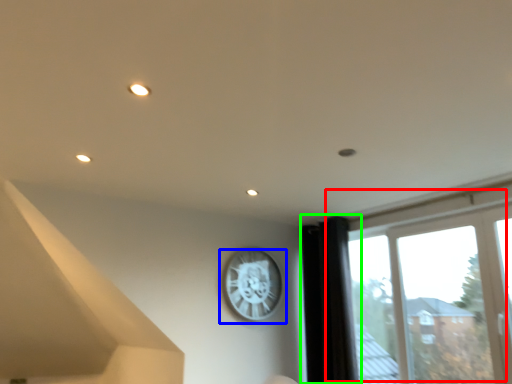
Question: Estimate the real-world distances between objects in this image. Which object is closer to window (highlighted by a red box), wall clock (highlighted by a blue box) or curtain (highlighted by a green box)?

Choices:
 (A) wall clock
 (B) curtain

Answer: (B)